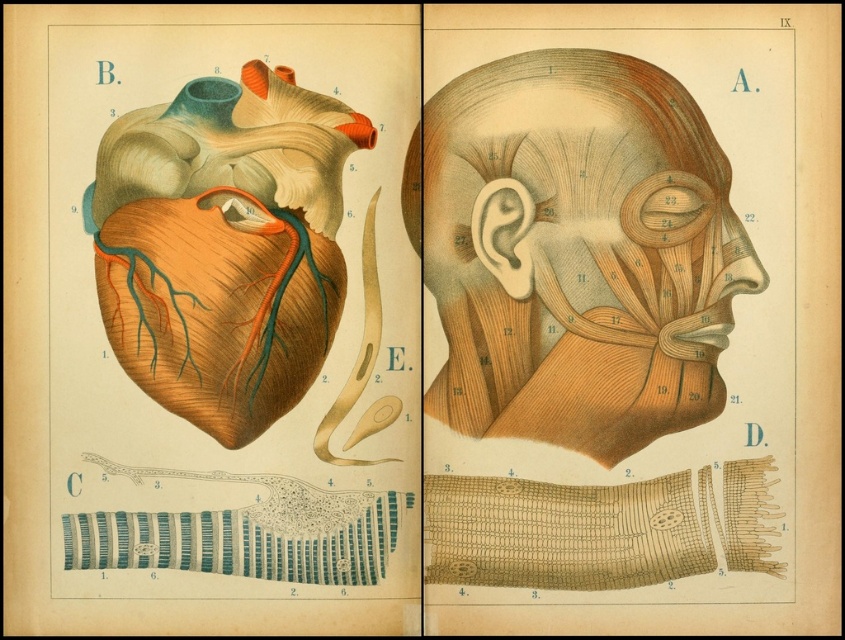
Question: Which of the following is the farthest from the observer?

Choices:
 (A) (524, 349)
 (B) (467, 96)

Answer: (A)

Question: Which point is farther to the camera?

Choices:
 (A) wooden neck at center
 (B) brown textured skin at center

Answer: (A)

Question: Where is brown textured skin at center located in relation to wooden neck at center in the image?

Choices:
 (A) below
 (B) above

Answer: (B)

Question: Can you confirm if brown textured skin at center is wider than wooden neck at center?

Choices:
 (A) yes
 (B) no

Answer: (A)

Question: Where is brown textured skin at center located in relation to wooden neck at center in the image?

Choices:
 (A) above
 (B) below

Answer: (A)